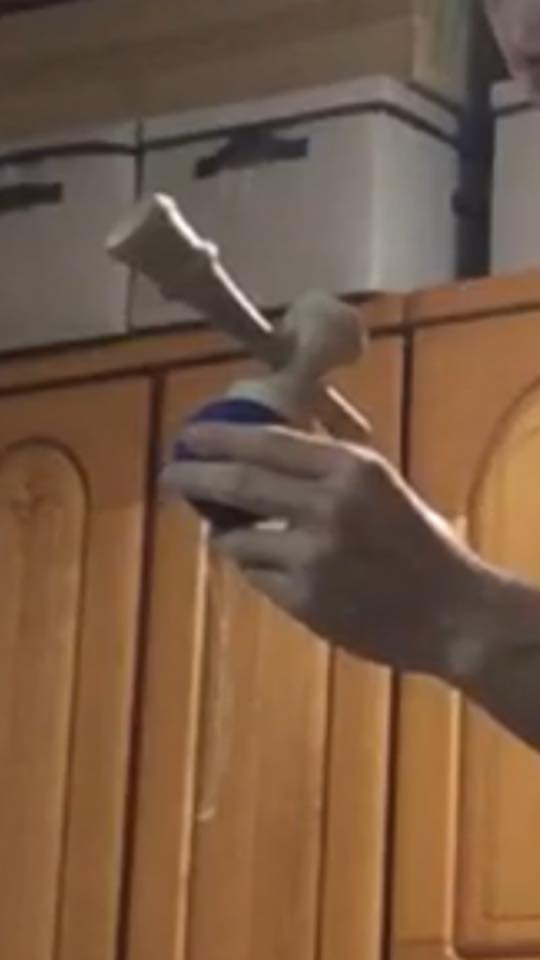
I want to click on boxes, so click(78, 203), click(328, 190).